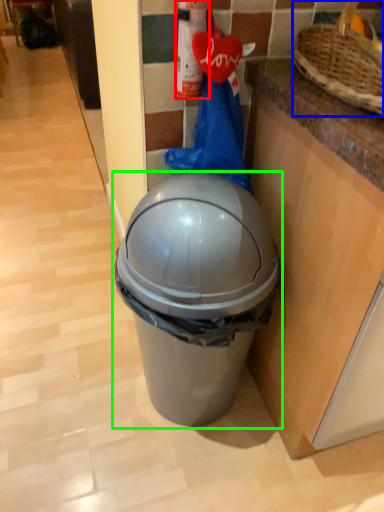
Question: Which object is positioned farthest from extinguisher (highlighted by a red box)? Select from basket (highlighted by a blue box) and waste container (highlighted by a green box).

Choices:
 (A) basket
 (B) waste container

Answer: (B)